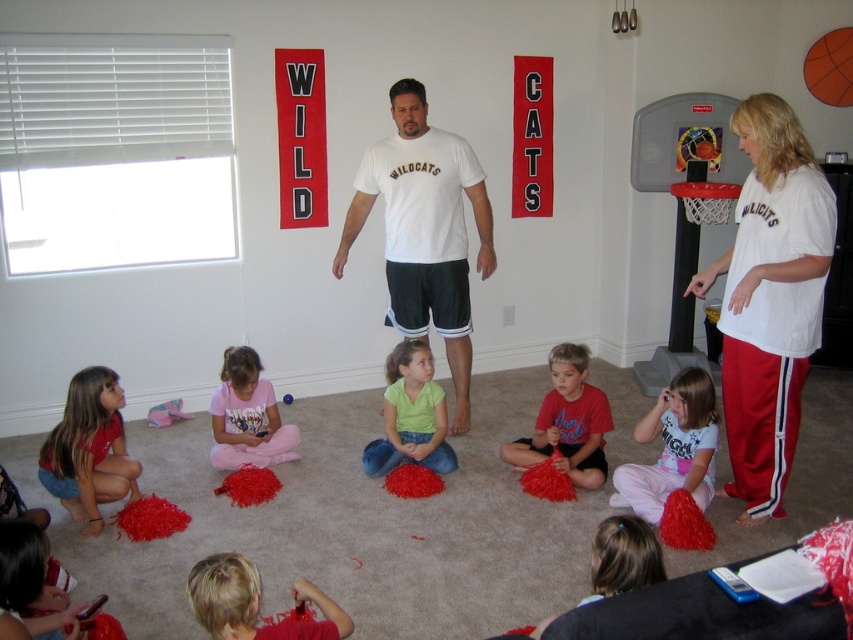
You are a photographer trying to capture a photo of the white cotton shirt at right and the orange matte basketball at upper right. To ensure both are in the frame, should you adjust your camera to focus more to the left or the right side of the scene?

The white cotton shirt at right is positioned on the left side of the orange matte basketball at upper right, so you should focus more to the left side of the scene to include both objects in the frame.

You are a photographer trying to capture a clear shot of both the pink cotton shirt at center and the pink fabric at center. Since they are both pink, you need to adjust your camera angle to distinguish them. Based on their positions, which object should you focus on first to ensure both are in frame?

The pink cotton shirt at center is positioned on the right side of pink fabric at center. To capture both in frame, focus on the pink fabric at center first as it is on the left, then adjust to include the pink cotton shirt at center on the right.